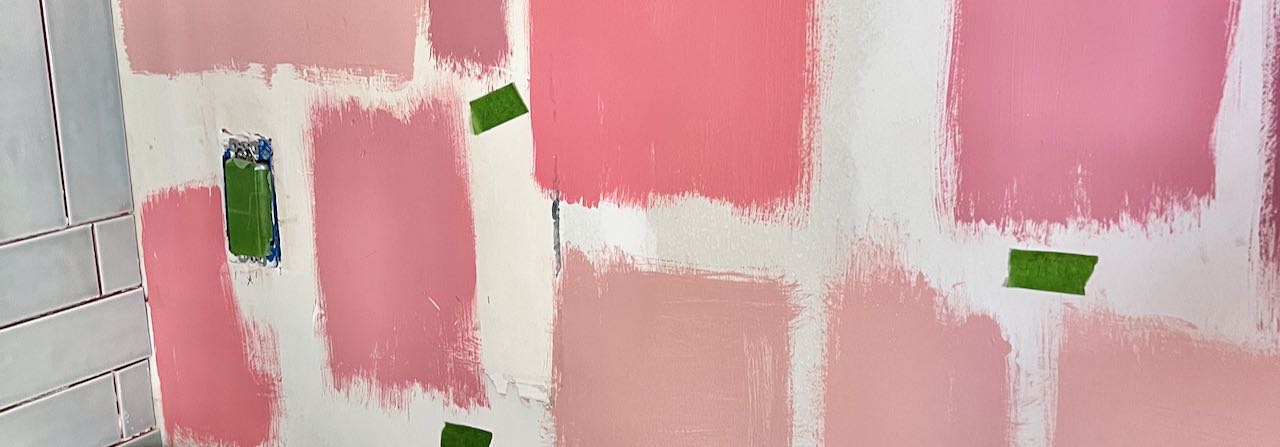
Where is `rightmost piece of tape`? rightmost piece of tape is located at coordinates (1046, 281).